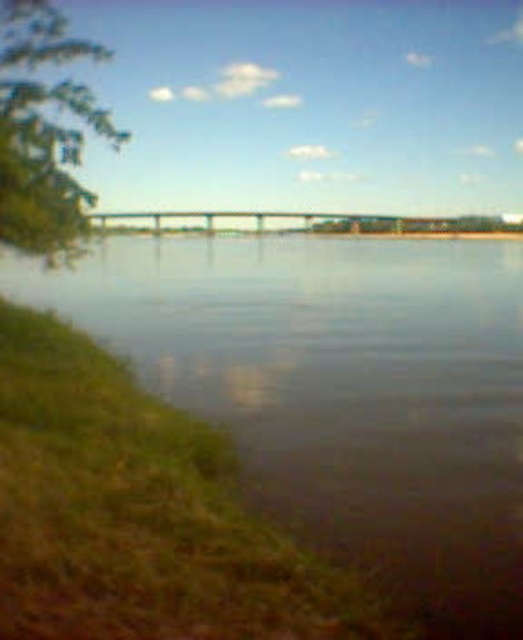
Looking at this image, does green leafy tree at left come behind green metallic bridge at center?

That is False.

Locate an element on the screen. The image size is (523, 640). green leafy tree at left is located at coordinates coord(43,131).

In order to click on green leafy tree at left in this screenshot , I will do `click(43, 131)`.

Can you confirm if brown reflective water at center is wider than green leafy tree at left?

Correct, the width of brown reflective water at center exceeds that of green leafy tree at left.

Is point (439, 452) behind point (82, 236)?

That is False.

Is point (480, 250) closer to camera compared to point (49, 234)?

No, it is not.

At what (x,y) coordinates should I click in order to perform the action: click on brown reflective water at center. Please return your answer as a coordinate pair (x, y). The width and height of the screenshot is (523, 640). Looking at the image, I should click on (339, 388).

Does brown reflective water at center appear on the right side of green metallic bridge at center?

Correct, you'll find brown reflective water at center to the right of green metallic bridge at center.

Is point (369, 397) positioned in front of point (393, 230)?

That is True.

This screenshot has width=523, height=640. What are the coordinates of `brown reflective water at center` in the screenshot? It's located at (339, 388).